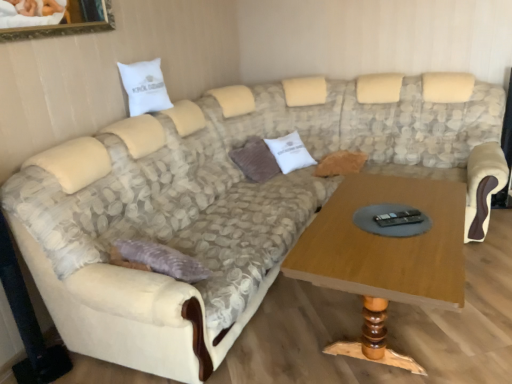
Question: Are white cotton pillow at center, acting as the third pillow starting from the left, and wooden coffee table at center far apart?

Choices:
 (A) yes
 (B) no

Answer: (A)

Question: Is white cotton pillow at center, acting as the third pillow starting from the left, oriented away from wooden coffee table at center?

Choices:
 (A) no
 (B) yes

Answer: (A)

Question: Considering the relative sizes of white cotton pillow at center, which ranks as the first pillow in right-to-left order, and wooden coffee table at center in the image provided, is white cotton pillow at center, which ranks as the first pillow in right-to-left order, smaller than wooden coffee table at center?

Choices:
 (A) no
 (B) yes

Answer: (B)

Question: Is white cotton pillow at center, acting as the third pillow starting from the left, further to camera compared to wooden coffee table at center?

Choices:
 (A) no
 (B) yes

Answer: (B)

Question: Can you confirm if white cotton pillow at center, which ranks as the first pillow in right-to-left order, is positioned to the left of wooden coffee table at center?

Choices:
 (A) no
 (B) yes

Answer: (B)

Question: Can you confirm if white cotton pillow at center, which ranks as the first pillow in right-to-left order, is taller than wooden coffee table at center?

Choices:
 (A) no
 (B) yes

Answer: (A)

Question: Is wooden coffee table at center thinner than brown corduroy pillow at center, the second pillow viewed from the left?

Choices:
 (A) yes
 (B) no

Answer: (B)

Question: Is wooden coffee table at center further to camera compared to brown corduroy pillow at center, which is the 2th pillow from right to left?

Choices:
 (A) no
 (B) yes

Answer: (A)

Question: From a real-world perspective, is wooden coffee table at center beneath brown corduroy pillow at center, which is the 2th pillow from right to left?

Choices:
 (A) no
 (B) yes

Answer: (B)

Question: From the image's perspective, would you say wooden coffee table at center is positioned over brown corduroy pillow at center, which is the 2th pillow from right to left?

Choices:
 (A) no
 (B) yes

Answer: (A)

Question: From the image's perspective, is wooden coffee table at center located beneath brown corduroy pillow at center, the second pillow viewed from the left?

Choices:
 (A) yes
 (B) no

Answer: (A)

Question: Can you confirm if wooden coffee table at center is smaller than brown corduroy pillow at center, which is the 2th pillow from right to left?

Choices:
 (A) no
 (B) yes

Answer: (A)

Question: Is brown corduroy pillow at center, the second pillow viewed from the left, positioned before white cotton pillow at center, which ranks as the first pillow in right-to-left order?

Choices:
 (A) no
 (B) yes

Answer: (B)